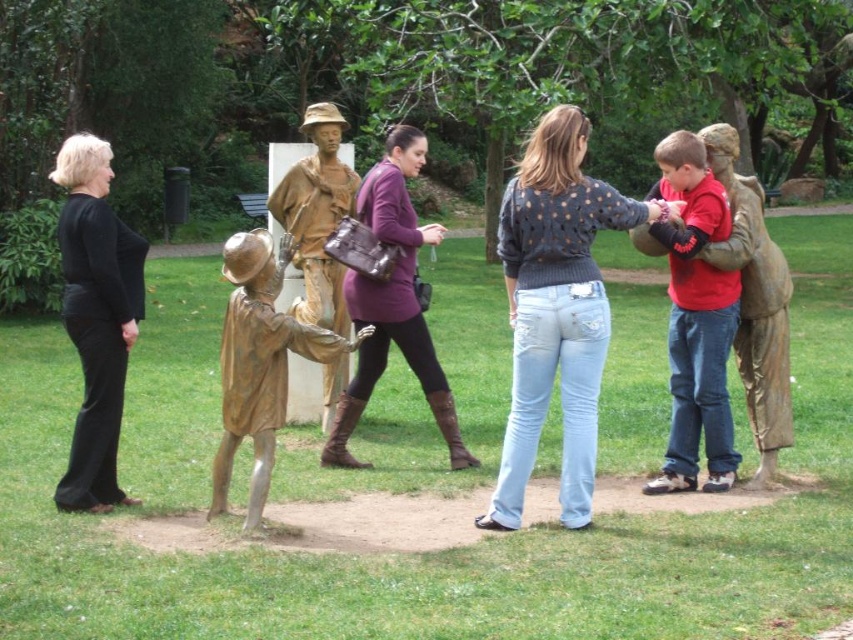
Measure the distance between matte purple sweater at center and bronze statue at center.

matte purple sweater at center is 1.29 meters from bronze statue at center.

Who is higher up, matte purple sweater at center or bronze statue at center?

bronze statue at center is higher up.

Which is behind, point (332, 440) or point (328, 316)?

The point (328, 316) is behind.

Find the location of `matte purple sweater at center`. matte purple sweater at center is located at coordinates (393, 301).

Between point (553, 310) and point (398, 260), which one is positioned in front?

Positioned in front is point (553, 310).

Does denim jeans at center have a greater height compared to matte purple sweater at center?

Indeed, denim jeans at center has a greater height compared to matte purple sweater at center.

Who is more forward, (543,273) or (431,362)?

Positioned in front is point (543,273).

Where is `denim jeans at center`? denim jeans at center is located at coordinates (555, 308).

Can you confirm if matte purple sweater at center is positioned above gold-bronze statue at center?

Indeed, matte purple sweater at center is positioned over gold-bronze statue at center.

Does matte purple sweater at center come in front of gold-bronze statue at center?

No.

The width and height of the screenshot is (853, 640). Find the location of `matte purple sweater at center`. matte purple sweater at center is located at coordinates (393, 301).